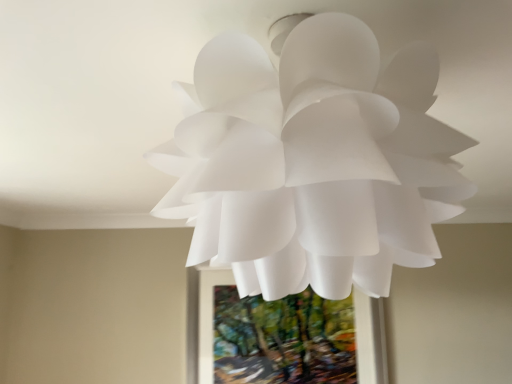
Question: Does green textured painting at center appear on the right side of white matte paper flower at center?

Choices:
 (A) yes
 (B) no

Answer: (A)

Question: Is green textured painting at center aimed at white matte paper flower at center?

Choices:
 (A) no
 (B) yes

Answer: (B)

Question: Does green textured painting at center have a greater height compared to white matte paper flower at center?

Choices:
 (A) no
 (B) yes

Answer: (B)

Question: From a real-world perspective, is green textured painting at center on top of white matte paper flower at center?

Choices:
 (A) yes
 (B) no

Answer: (B)

Question: From the image's perspective, is green textured painting at center above white matte paper flower at center?

Choices:
 (A) no
 (B) yes

Answer: (A)

Question: From a real-world perspective, is green textured painting at center located beneath white matte paper flower at center?

Choices:
 (A) no
 (B) yes

Answer: (B)

Question: Is white matte paper flower at center positioned in front of green textured painting at center?

Choices:
 (A) yes
 (B) no

Answer: (A)

Question: From the image's perspective, does white matte paper flower at center appear higher than green textured painting at center?

Choices:
 (A) yes
 (B) no

Answer: (A)

Question: Is white matte paper flower at center at the right side of green textured painting at center?

Choices:
 (A) no
 (B) yes

Answer: (A)

Question: Is white matte paper flower at center far from green textured painting at center?

Choices:
 (A) no
 (B) yes

Answer: (B)

Question: Is white matte paper flower at center bigger than green textured painting at center?

Choices:
 (A) yes
 (B) no

Answer: (A)

Question: Would you say white matte paper flower at center contains green textured painting at center?

Choices:
 (A) no
 (B) yes

Answer: (A)

Question: From the image's perspective, relative to green textured painting at center, is white matte paper flower at center above or below?

Choices:
 (A) above
 (B) below

Answer: (A)